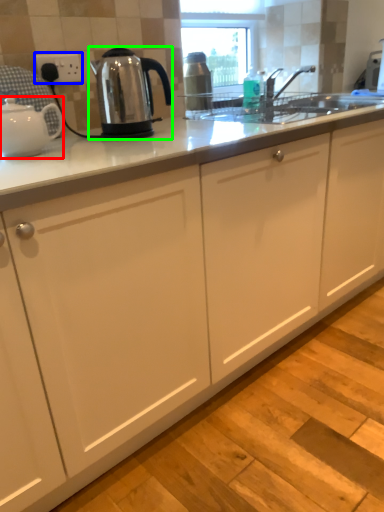
Question: Which object is positioned closest to kettle (highlighted by a red box)? Select from electric outlet (highlighted by a blue box) and kettle (highlighted by a green box).

Choices:
 (A) electric outlet
 (B) kettle

Answer: (B)